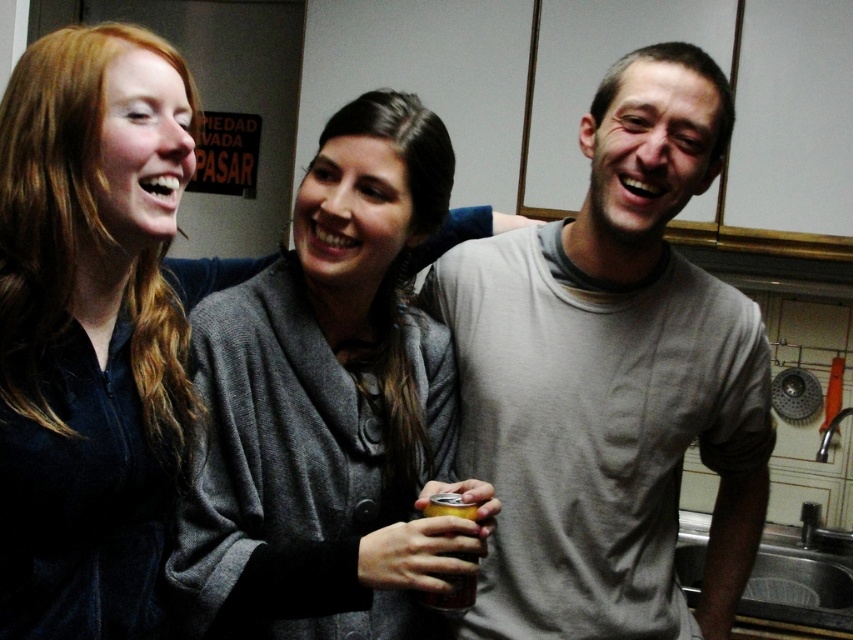
Is point (723, 356) less distant than point (469, 598)?

No, (723, 356) is behind (469, 598).

Does gray cotton t-shirt at center appear over metallic gold can at center?

Correct, gray cotton t-shirt at center is located above metallic gold can at center.

Is point (567, 605) closer to camera compared to point (425, 598)?

No.

You are a GUI agent. You are given a task and a screenshot of the screen. Output one action in this format:
    pyautogui.click(x=<x>, y=<y>)
    Task: Click on the gray cotton t-shirt at center
    The height and width of the screenshot is (640, 853).
    Given the screenshot: What is the action you would take?
    pyautogui.click(x=610, y=380)

Which of these two, gray wool sweater at center or velvet dark blue shirt at left, stands taller?

Standing taller between the two is gray wool sweater at center.

Does gray wool sweater at center have a smaller size compared to velvet dark blue shirt at left?

No, gray wool sweater at center is not smaller than velvet dark blue shirt at left.

Who is more distant from viewer, (366, 225) or (28, 200)?

The point (366, 225) is behind.

This screenshot has height=640, width=853. I want to click on gray wool sweater at center, so click(325, 397).

Who is higher up, velvet dark blue shirt at left or metallic gold can at center?

Positioned higher is velvet dark blue shirt at left.

Does velvet dark blue shirt at left appear on the right side of metallic gold can at center?

Incorrect, velvet dark blue shirt at left is not on the right side of metallic gold can at center.

Does point (3, 310) come farther from viewer compared to point (451, 595)?

No.

In order to click on velvet dark blue shirt at left in this screenshot , I will do `click(83, 349)`.